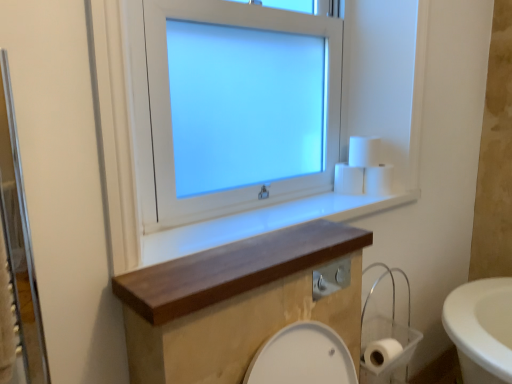
Question: Which direction should I rotate to look at white matte toilet paper at center, acting as the 2th toilet paper starting from the top, — up or down?

Choices:
 (A) down
 (B) up

Answer: (B)

Question: Does white matte toilet paper at lower right, acting as the 4th toilet paper starting from the top, have a smaller size compared to white matte toilet paper at center, acting as the 2th toilet paper starting from the top?

Choices:
 (A) no
 (B) yes

Answer: (A)

Question: Is white matte toilet paper at lower right, the first toilet paper positioned from the bottom, far away from white matte toilet paper at center, the third toilet paper in the bottom-to-top sequence?

Choices:
 (A) yes
 (B) no

Answer: (B)

Question: Can you confirm if white matte toilet paper at lower right, acting as the 4th toilet paper starting from the top, is positioned to the right of white matte toilet paper at center, acting as the 2th toilet paper starting from the top?

Choices:
 (A) yes
 (B) no

Answer: (A)

Question: Can you confirm if white matte toilet paper at lower right, the first toilet paper positioned from the bottom, is thinner than white matte toilet paper at center, acting as the 2th toilet paper starting from the top?

Choices:
 (A) no
 (B) yes

Answer: (A)

Question: Is the depth of white matte toilet paper at lower right, acting as the 4th toilet paper starting from the top, less than that of white matte toilet paper at center, the third toilet paper in the bottom-to-top sequence?

Choices:
 (A) no
 (B) yes

Answer: (B)

Question: Considering the relative sizes of white matte toilet paper at lower right, the first toilet paper positioned from the bottom, and white matte toilet paper at center, acting as the 2th toilet paper starting from the top, in the image provided, is white matte toilet paper at lower right, the first toilet paper positioned from the bottom, bigger than white matte toilet paper at center, acting as the 2th toilet paper starting from the top,?

Choices:
 (A) no
 (B) yes

Answer: (B)

Question: Does white matte toilet paper at center, acting as the 2th toilet paper starting from the top, come behind white glossy window at upper center?

Choices:
 (A) no
 (B) yes

Answer: (B)

Question: Could white glossy window at upper center be considered to be inside white matte toilet paper at center, acting as the 2th toilet paper starting from the top?

Choices:
 (A) yes
 (B) no

Answer: (B)

Question: Is white matte toilet paper at center, the third toilet paper in the bottom-to-top sequence, smaller than white glossy window at upper center?

Choices:
 (A) yes
 (B) no

Answer: (A)

Question: Is white matte toilet paper at center, acting as the 2th toilet paper starting from the top, to the left of white glossy window at upper center from the viewer's perspective?

Choices:
 (A) no
 (B) yes

Answer: (A)

Question: Can you confirm if white matte toilet paper at center, the third toilet paper in the bottom-to-top sequence, is positioned to the right of white glossy window at upper center?

Choices:
 (A) no
 (B) yes

Answer: (B)

Question: Is white matte toilet paper at center, the third toilet paper in the bottom-to-top sequence, not close to white glossy window at upper center?

Choices:
 (A) no
 (B) yes

Answer: (A)

Question: Can you confirm if wooden shelf at center is positioned to the left of wooden at upper center?

Choices:
 (A) no
 (B) yes

Answer: (B)